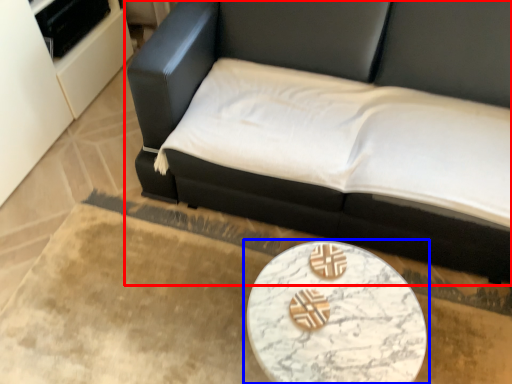
Question: Which object is further to the camera taking this photo, studio couch (highlighted by a red box) or table (highlighted by a blue box)?

Choices:
 (A) studio couch
 (B) table

Answer: (B)